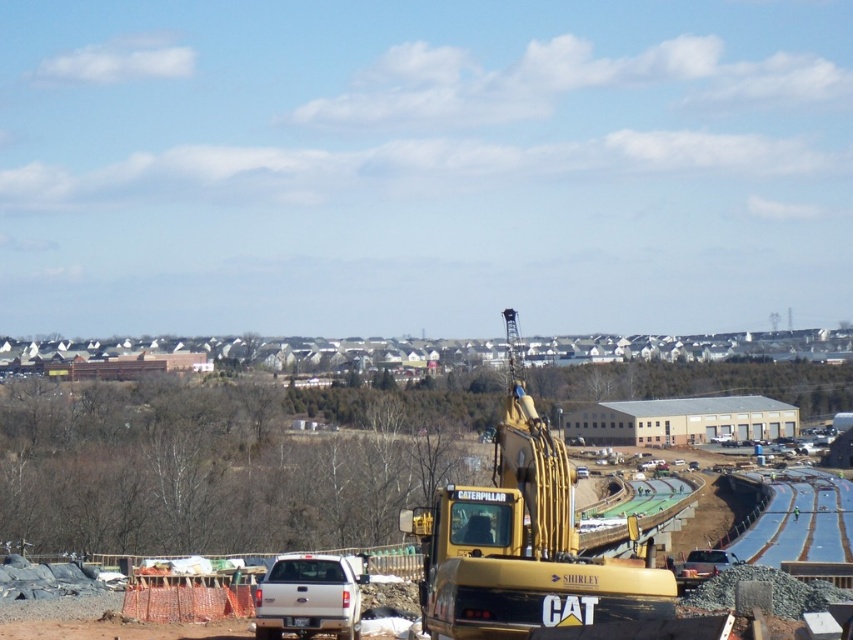
You are a construction worker standing at the edge of the construction site. You need to move the metallic silver car at center to a different location. However, the yellow metallic excavator at center is blocking your path. Can you move the excavator to access the car?

The yellow metallic excavator at center is above the metallic silver car at center, meaning it is positioned higher up or elevated relative to the car. This elevation might make it physically possible to move the excavator to access the car, provided there is enough space and clearance around the excavator to maneuver it out of the way.

You are a construction worker standing at the edge of the construction site. You need to determine which object is taller between the yellow metallic excavator at center and the white matte truck at center. Based on the scene, which one is taller?

The yellow metallic excavator at center is taller than the white matte truck at center.